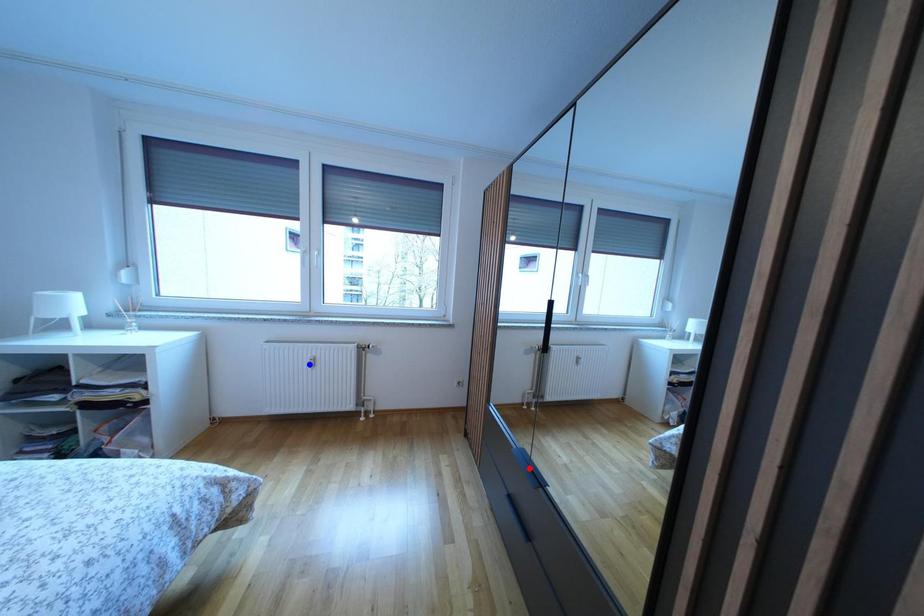
Question: In the image, two points are highlighted. Which point is nearer to the camera? Reply with the corresponding letter.

Choices:
 (A) blue point
 (B) red point

Answer: (B)